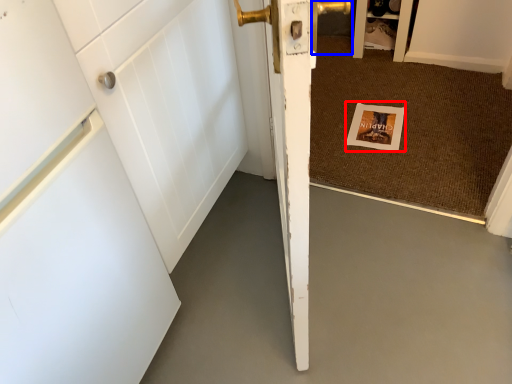
Question: Which of the following is the farthest to the observer, postcard (highlighted by a red box) or door handle (highlighted by a blue box)?

Choices:
 (A) postcard
 (B) door handle

Answer: (B)